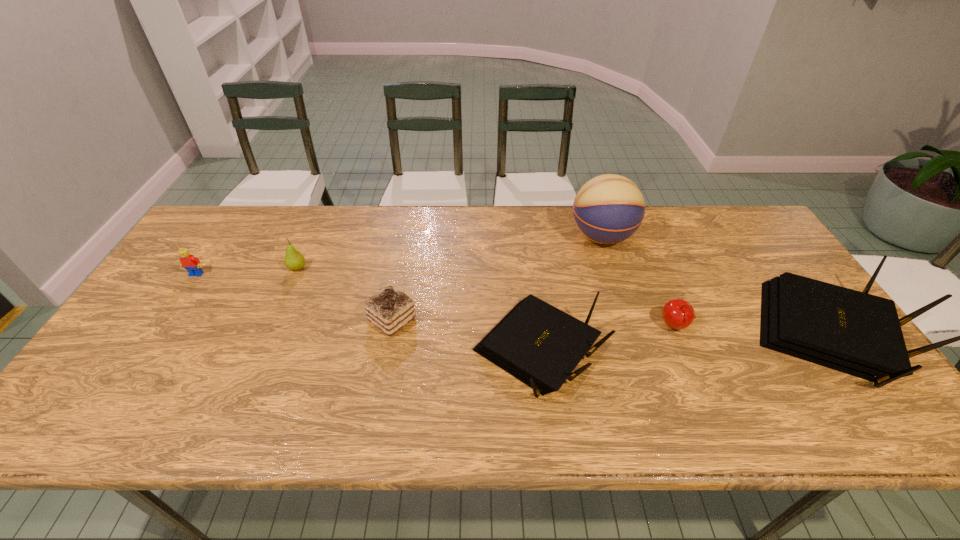
You are a GUI agent. You are given a task and a screenshot of the screen. Output one action in this format:
    pyautogui.click(x=<x>, y=<y>)
    Task: Click on the vacant space positioned on the patterned surface of the basketball
    The image size is (960, 540).
    Given the screenshot: What is the action you would take?
    pyautogui.click(x=525, y=237)

Where is `free space located 0.100m on the patterned surface of the basketball`? The height and width of the screenshot is (540, 960). free space located 0.100m on the patterned surface of the basketball is located at coordinates (538, 237).

Find the location of a particular element. free space located 0.160m on the patterned surface of the basketball is located at coordinates (518, 237).

Locate an element on the screen. The width and height of the screenshot is (960, 540). free spot located on the face of the leftmost object is located at coordinates (156, 334).

Locate an element on the screen. The image size is (960, 540). free space located on the back of the third object from left to right is located at coordinates pyautogui.click(x=404, y=256).

The height and width of the screenshot is (540, 960). Find the location of `free space located 0.230m on the back of the cherry`. free space located 0.230m on the back of the cherry is located at coordinates (646, 256).

Identify the location of object situated at the far edge. (609, 208).

The height and width of the screenshot is (540, 960). Identify the location of object that is at the near edge. coord(540,345).

At what (x,y) coordinates should I click in order to perform the action: click on object that is positioned at the left edge. Please return your answer as a coordinate pair (x, y). This screenshot has height=540, width=960. Looking at the image, I should click on (192, 264).

I want to click on vacant space at the far edge of the desktop, so coord(619,244).